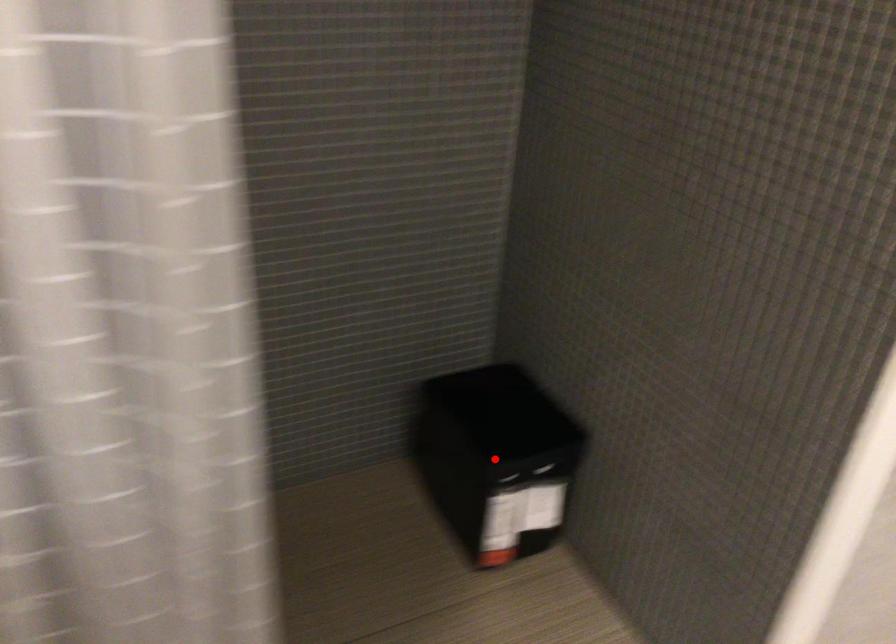
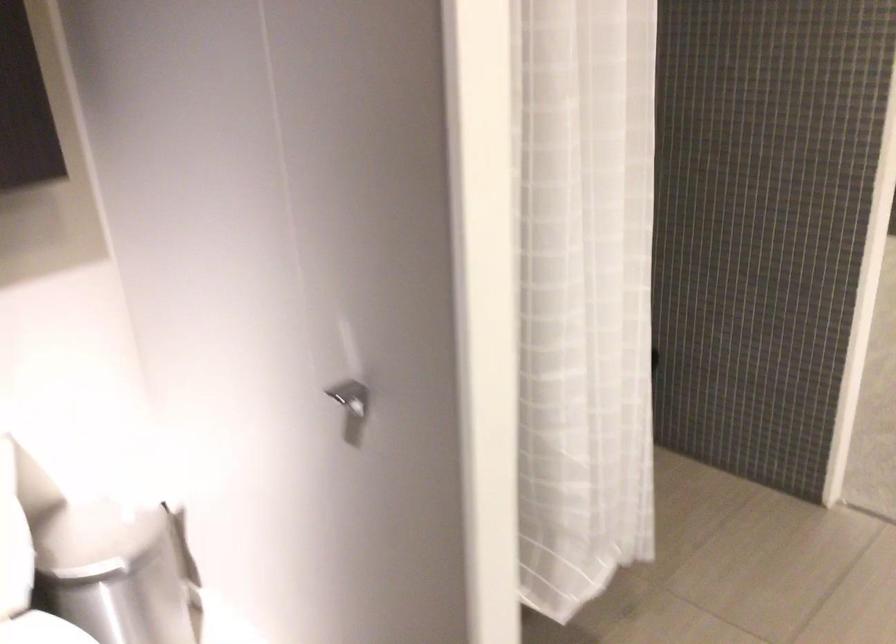
Question: I am providing you with two images of the same scene from different viewpoints. A red point is marked on the first image. Is the red point's position out of view in image 2?

Choices:
 (A) Yes
 (B) No

Answer: (A)